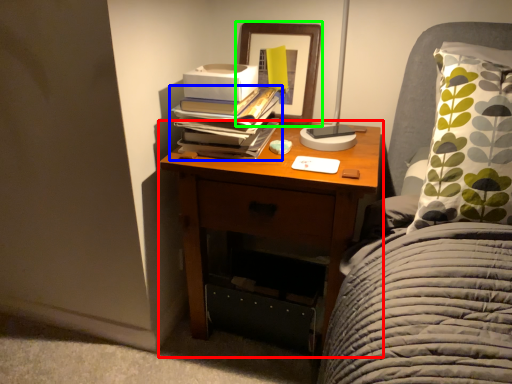
Question: Which object is positioned closest to nightstand (highlighted by a red box)? Select from book (highlighted by a blue box) and picture frame (highlighted by a green box).

Choices:
 (A) book
 (B) picture frame

Answer: (A)